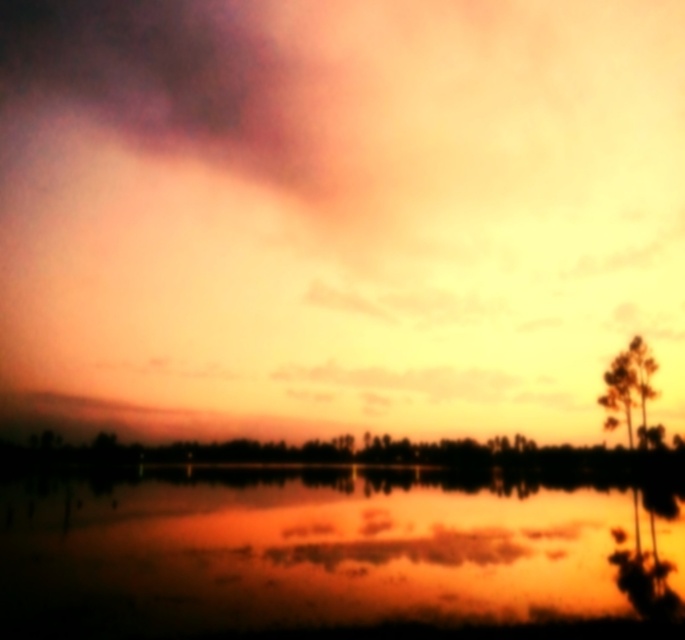
Question: In this image, where is matte orange cloud at upper center located relative to reflective water at center?

Choices:
 (A) right
 (B) left

Answer: (A)

Question: Does reflective water at center lie in front of green matte tree at right?

Choices:
 (A) yes
 (B) no

Answer: (A)

Question: Estimate the real-world distances between objects in this image. Which object is farther from the green matte tree at right?

Choices:
 (A) reflective water at center
 (B) matte orange cloud at upper center

Answer: (B)

Question: Which object is the farthest from the matte orange cloud at upper center?

Choices:
 (A) green matte tree at right
 (B) reflective water at center

Answer: (A)

Question: Which object is positioned farthest from the matte orange cloud at upper center?

Choices:
 (A) green matte tree at right
 (B) reflective water at center

Answer: (A)

Question: Is matte orange cloud at upper center thinner than reflective water at center?

Choices:
 (A) yes
 (B) no

Answer: (B)